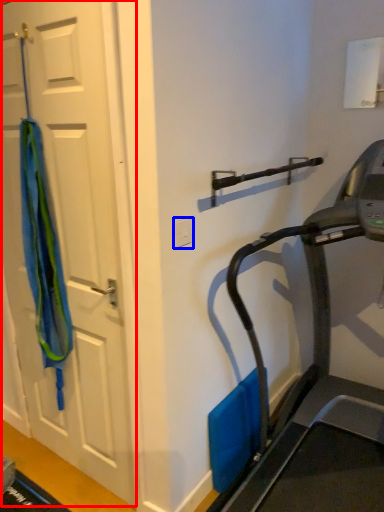
Question: Which object is closer to the camera taking this photo, door (highlighted by a red box) or electric outlet (highlighted by a blue box)?

Choices:
 (A) door
 (B) electric outlet

Answer: (A)